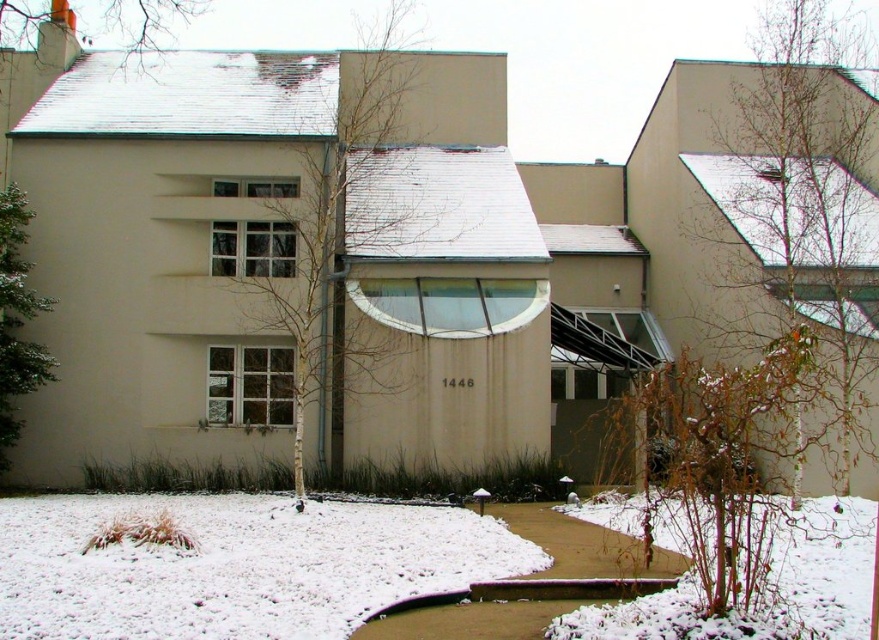
Does bare branches at center appear over white snow-covered tree at upper left?

Actually, bare branches at center is below white snow-covered tree at upper left.

Is point (302, 305) positioned behind point (113, 4)?

That is False.

The height and width of the screenshot is (640, 879). I want to click on bare branches at center, so coord(350,216).

Can you confirm if bare branches at right is positioned to the right of bare branches at center?

Yes, bare branches at right is to the right of bare branches at center.

Is point (865, 291) positioned behind point (390, 138)?

No, (865, 291) is in front of (390, 138).

Locate an element on the screen. The image size is (879, 640). bare branches at right is located at coordinates (807, 209).

Measure the distance from bare branches at right to green textured evergreen tree at left.

The distance of bare branches at right from green textured evergreen tree at left is 66.39 feet.

What do you see at coordinates (807, 209) in the screenshot? I see `bare branches at right` at bounding box center [807, 209].

Does point (869, 182) come behind point (4, 296)?

Yes.

Locate an element on the screen. Image resolution: width=879 pixels, height=640 pixels. bare branches at right is located at coordinates (807, 209).